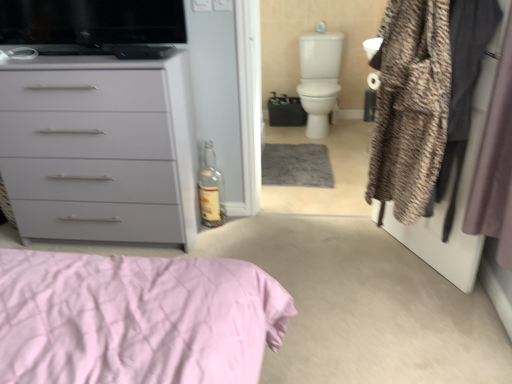
What do you see at coordinates (211, 190) in the screenshot? I see `transparent glass bottle at center` at bounding box center [211, 190].

Describe the element at coordinates (92, 25) in the screenshot. I see `black glossy tv at upper left` at that location.

Find the location of a particular element. The width and height of the screenshot is (512, 384). silky purple curtain at right is located at coordinates (495, 163).

The height and width of the screenshot is (384, 512). I want to click on matte gray chest of drawers at left, so click(x=100, y=149).

The width and height of the screenshot is (512, 384). Describe the element at coordinates (100, 149) in the screenshot. I see `matte gray chest of drawers at left` at that location.

The height and width of the screenshot is (384, 512). I want to click on white glossy toilet bowl at upper right, so click(318, 104).

Between silky purple curtain at right and black glossy tv at upper left, which one appears on the left side from the viewer's perspective?

From the viewer's perspective, black glossy tv at upper left appears more on the left side.

Considering the sizes of objects silky purple curtain at right and black glossy tv at upper left in the image provided, who is smaller, silky purple curtain at right or black glossy tv at upper left?

black glossy tv at upper left is smaller.

How different are the orientations of silky purple curtain at right and black glossy tv at upper left in degrees?

They differ by 90.7 degrees in their facing directions.

Which is behind, silky purple curtain at right or black glossy tv at upper left?

black glossy tv at upper left is behind.

Does fuzzy fabric coat at right contain silky purple curtain at right?

No, silky purple curtain at right is not a part of fuzzy fabric coat at right.

From the image's perspective, does fuzzy fabric coat at right appear higher than silky purple curtain at right?

Yes.

Consider the image. Which of these two, fuzzy fabric coat at right or silky purple curtain at right, is bigger?

fuzzy fabric coat at right is bigger.

Is transparent glass bottle at center directly adjacent to matte gray chest of drawers at left?

No.

Is transparent glass bottle at center inside or outside of matte gray chest of drawers at left?

transparent glass bottle at center cannot be found inside matte gray chest of drawers at left.

Is transparent glass bottle at center wider than matte gray chest of drawers at left?

In fact, transparent glass bottle at center might be narrower than matte gray chest of drawers at left.

Could you tell me if black glossy tv at upper left is facing silky purple curtain at right?

No, black glossy tv at upper left does not turn towards silky purple curtain at right.

From the image's perspective, does black glossy tv at upper left appear lower than silky purple curtain at right?

No, from the image's perspective, black glossy tv at upper left is not below silky purple curtain at right.

Is black glossy tv at upper left positioned before silky purple curtain at right?

No, the depth of black glossy tv at upper left is greater than that of silky purple curtain at right.

Based on the photo, considering the sizes of objects black glossy tv at upper left and silky purple curtain at right in the image provided, who is shorter, black glossy tv at upper left or silky purple curtain at right?

black glossy tv at upper left is shorter.

Is white glossy toilet bowl at upper right bigger than fuzzy fabric coat at right?

Indeed, white glossy toilet bowl at upper right has a larger size compared to fuzzy fabric coat at right.

The height and width of the screenshot is (384, 512). What are the coordinates of `screen door lying on the right of white glossy toilet bowl at upper right` in the screenshot? It's located at (448, 207).

From the image's perspective, which object appears higher, white glossy toilet bowl at upper right or fuzzy fabric coat at right?

white glossy toilet bowl at upper right.

Does white glossy toilet bowl at upper right have a lesser width compared to fuzzy fabric coat at right?

In fact, white glossy toilet bowl at upper right might be wider than fuzzy fabric coat at right.

Is matte gray chest of drawers at left bigger or smaller than transparent glass bottle at center?

Considering their sizes, matte gray chest of drawers at left takes up more space than transparent glass bottle at center.

From the image's perspective, does matte gray chest of drawers at left appear lower than transparent glass bottle at center?

No, from the image's perspective, matte gray chest of drawers at left is not below transparent glass bottle at center.

In the image, is matte gray chest of drawers at left positioned in front of or behind transparent glass bottle at center?

Visually, matte gray chest of drawers at left is located in front of transparent glass bottle at center.

Consider the image. Which is nearer, (162, 177) or (201, 179)?

The point (162, 177) is more forward.

Considering the relative positions of white glossy toilet bowl at upper right and black glossy tv at upper left in the image provided, is white glossy toilet bowl at upper right to the right of black glossy tv at upper left from the viewer's perspective?

Correct, you'll find white glossy toilet bowl at upper right to the right of black glossy tv at upper left.

Does white glossy toilet bowl at upper right have a larger size compared to black glossy tv at upper left?

Correct, white glossy toilet bowl at upper right is larger in size than black glossy tv at upper left.

From the image's perspective, is white glossy toilet bowl at upper right beneath black glossy tv at upper left?

No, from the image's perspective, white glossy toilet bowl at upper right is not beneath black glossy tv at upper left.

Between white glossy toilet bowl at upper right and black glossy tv at upper left, which one has smaller width?

Thinner between the two is black glossy tv at upper left.

What are the coordinates of `curtain lying in front of the black glossy tv at upper left` in the screenshot? It's located at (495, 163).

At what (x,y) coordinates should I click in order to perform the action: click on screen door that appears on the left of silky purple curtain at right. Please return your answer as a coordinate pair (x, y). The height and width of the screenshot is (384, 512). Looking at the image, I should click on (448, 207).

Considering their positions, is textured brown coat at right positioned further to white glossy toilet bowl at upper right than transparent glass bottle at center?

Among the two, textured brown coat at right is located further to white glossy toilet bowl at upper right.

Considering their positions, is white glossy toilet bowl at upper right positioned closer to matte gray chest of drawers at left than transparent glass bottle at center?

Among the two, transparent glass bottle at center is located nearer to matte gray chest of drawers at left.

From the image, which object appears to be farther from matte gray chest of drawers at left, silky purple curtain at right or textured brown coat at right?

The object further to matte gray chest of drawers at left is silky purple curtain at right.

Looking at the image, which one is located closer to white glossy toilet bowl at upper right, black glossy tv at upper left or matte gray chest of drawers at left?

black glossy tv at upper left is closer to white glossy toilet bowl at upper right.

Estimate the real-world distances between objects in this image. Which object is further from matte gray chest of drawers at left, black glossy tv at upper left or white glossy toilet bowl at upper right?

white glossy toilet bowl at upper right.

When comparing their distances from textured brown coat at right, does white glossy toilet bowl at upper right or transparent glass bottle at center seem closer?

The object closer to textured brown coat at right is transparent glass bottle at center.

When comparing their distances from textured brown coat at right, does transparent glass bottle at center or black glossy tv at upper left seem further?

black glossy tv at upper left is positioned further to the anchor textured brown coat at right.

Which object lies further to the anchor point white glossy toilet bowl at upper right, black glossy tv at upper left or textured brown coat at right?

Among the two, textured brown coat at right is located further to white glossy toilet bowl at upper right.

Locate an element on the screen. chest of drawers between textured brown coat at right and white glossy toilet bowl at upper right in the front-back direction is located at coordinates (100, 149).

This screenshot has width=512, height=384. I want to click on bottle between textured brown coat at right and white glossy toilet bowl at upper right in the front-back direction, so click(x=211, y=190).

I want to click on appliance located between matte gray chest of drawers at left and white glossy toilet bowl at upper right in the depth direction, so click(x=92, y=25).

Image resolution: width=512 pixels, height=384 pixels. In order to click on chest of drawers between black glossy tv at upper left and textured brown coat at right in the horizontal direction in this screenshot , I will do `click(100, 149)`.